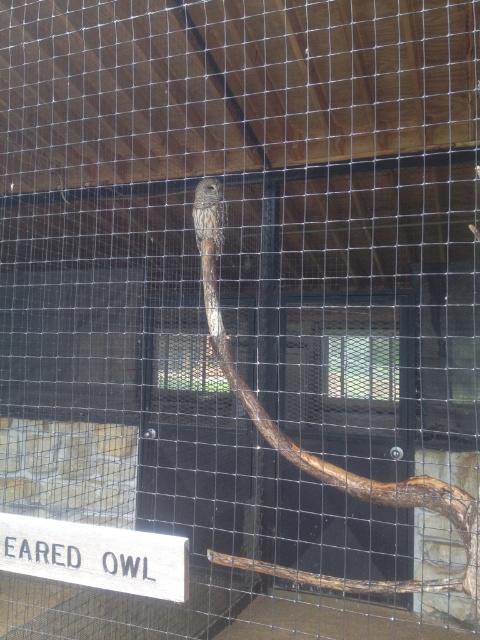
Looking at this image, you are a visitor at the zoo and see the brown rough branch at center and the white wood sign at lower left in the enclosure. Which object is positioned higher in the image?

The brown rough branch at center is above the white wood sign at lower left, so it is positioned higher in the image.

You are a visitor at a wildlife sanctuary and see the barred owl in its enclosure. You notice a brown rough branch at center and a white wood sign at lower left. Which object is positioned to the right of the other?

The brown rough branch at center is to the right of white wood sign at lower left.